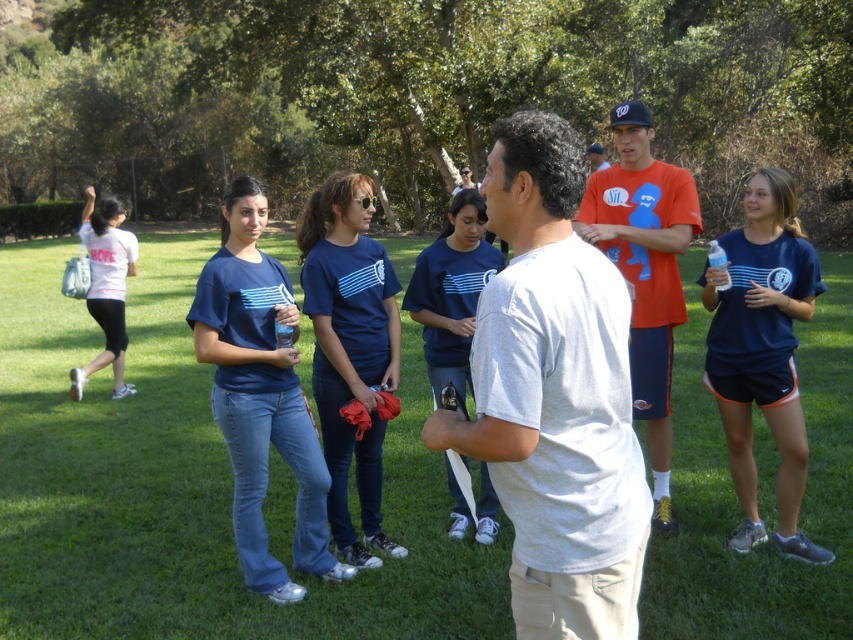
Does green grass at center appear over white matte t-shirt at left?

Actually, green grass at center is below white matte t-shirt at left.

Between green grass at center and white matte t-shirt at left, which one appears on the left side from the viewer's perspective?

Positioned to the left is white matte t-shirt at left.

Who is more distant from viewer, (196, 484) or (85, 211)?

The point (85, 211) is behind.

The width and height of the screenshot is (853, 640). Identify the location of green grass at center. (189, 484).

Does green grass at center have a lesser width compared to matte blue shirt at center?

In fact, green grass at center might be wider than matte blue shirt at center.

Is green grass at center behind matte blue shirt at center?

That is False.

Is point (807, 336) in front of point (476, 182)?

Yes.

This screenshot has width=853, height=640. What are the coordinates of `green grass at center` in the screenshot? It's located at (189, 484).

Who is positioned more to the left, blue fabric shirt at center or orange t-shirt at center?

orange t-shirt at center is more to the left.

Is blue fabric shirt at center closer to camera compared to orange t-shirt at center?

No, it is not.

Between point (786, 344) and point (668, 307), which one is positioned behind?

Point (668, 307)

The width and height of the screenshot is (853, 640). I want to click on blue fabric shirt at center, so click(x=763, y=353).